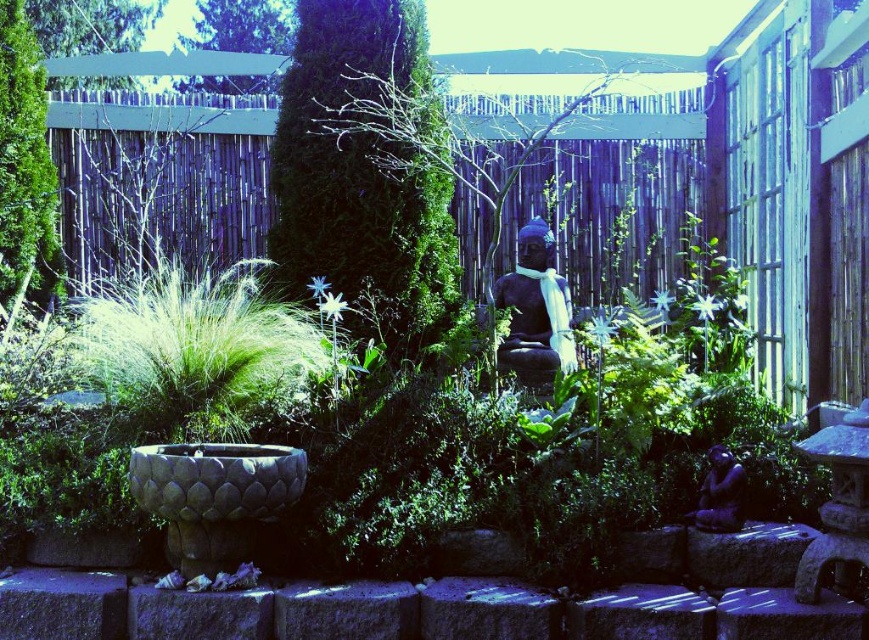
Question: Does green textured bush at left appear on the left side of satin black statue at center?

Choices:
 (A) no
 (B) yes

Answer: (B)

Question: Which point appears farthest from the camera in this image?

Choices:
 (A) (741, 484)
 (B) (434, 236)
 (C) (45, 196)
 (D) (532, 244)

Answer: (C)

Question: Estimate the real-world distances between objects in this image. Which object is farther from the green textured bush at left?

Choices:
 (A) black stone statue at center
 (B) satin black statue at center
 (C) green textured bush at center

Answer: (B)

Question: Does green textured bush at center appear on the right side of satin black statue at center?

Choices:
 (A) no
 (B) yes

Answer: (A)

Question: Does green textured bush at center have a smaller size compared to green textured bush at left?

Choices:
 (A) no
 (B) yes

Answer: (A)

Question: Which of the following is the farthest from the observer?

Choices:
 (A) (715, 506)
 (B) (521, 365)
 (C) (38, 234)

Answer: (C)